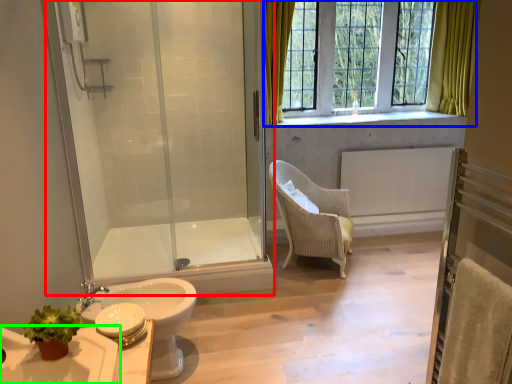
Question: Based on their relative distances, which object is farther from shower door (highlighted by a red box)? Choose from window (highlighted by a blue box) and sink (highlighted by a green box).

Choices:
 (A) window
 (B) sink

Answer: (A)